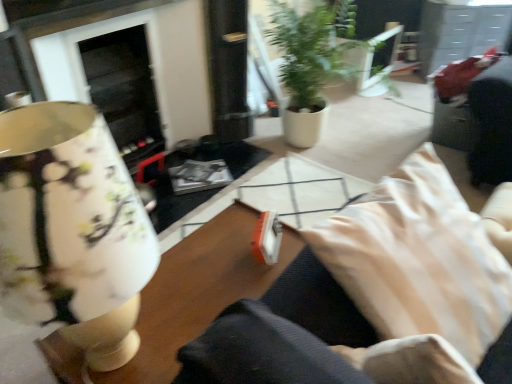
Question: From a real-world perspective, is wooden table at center on top of beige fabric pillow at lower right?

Choices:
 (A) yes
 (B) no

Answer: (B)

Question: From a real-world perspective, is wooden table at center below beige fabric pillow at lower right?

Choices:
 (A) yes
 (B) no

Answer: (A)

Question: Could you tell me if wooden table at center is facing beige fabric pillow at lower right?

Choices:
 (A) yes
 (B) no

Answer: (B)

Question: Is wooden table at center thinner than beige fabric pillow at lower right?

Choices:
 (A) no
 (B) yes

Answer: (B)

Question: Can beige fabric pillow at lower right be found inside wooden table at center?

Choices:
 (A) yes
 (B) no

Answer: (B)

Question: Is matte floral lampshade at left bigger or smaller than green matte plant at center?

Choices:
 (A) big
 (B) small

Answer: (B)

Question: Considering their positions, is matte floral lampshade at left located in front of or behind green matte plant at center?

Choices:
 (A) behind
 (B) front

Answer: (B)

Question: Is matte floral lampshade at left taller or shorter than green matte plant at center?

Choices:
 (A) short
 (B) tall

Answer: (A)

Question: Visually, is matte floral lampshade at left positioned to the left or to the right of green matte plant at center?

Choices:
 (A) right
 (B) left

Answer: (B)

Question: From their relative heights in the image, would you say green matte plant at center is taller or shorter than beige fabric pillow at lower right?

Choices:
 (A) tall
 (B) short

Answer: (A)

Question: From the image's perspective, is green matte plant at center positioned above or below beige fabric pillow at lower right?

Choices:
 (A) above
 (B) below

Answer: (A)

Question: From a real-world perspective, relative to beige fabric pillow at lower right, is green matte plant at center vertically above or below?

Choices:
 (A) above
 (B) below

Answer: (B)

Question: Is point (300, 51) positioned closer to the camera than point (500, 278)?

Choices:
 (A) farther
 (B) closer

Answer: (A)

Question: In the image, is wooden table at center on the left side or the right side of beige fabric pillow at lower right?

Choices:
 (A) right
 (B) left

Answer: (B)

Question: Is point (204, 312) positioned closer to the camera than point (440, 253)?

Choices:
 (A) farther
 (B) closer

Answer: (A)